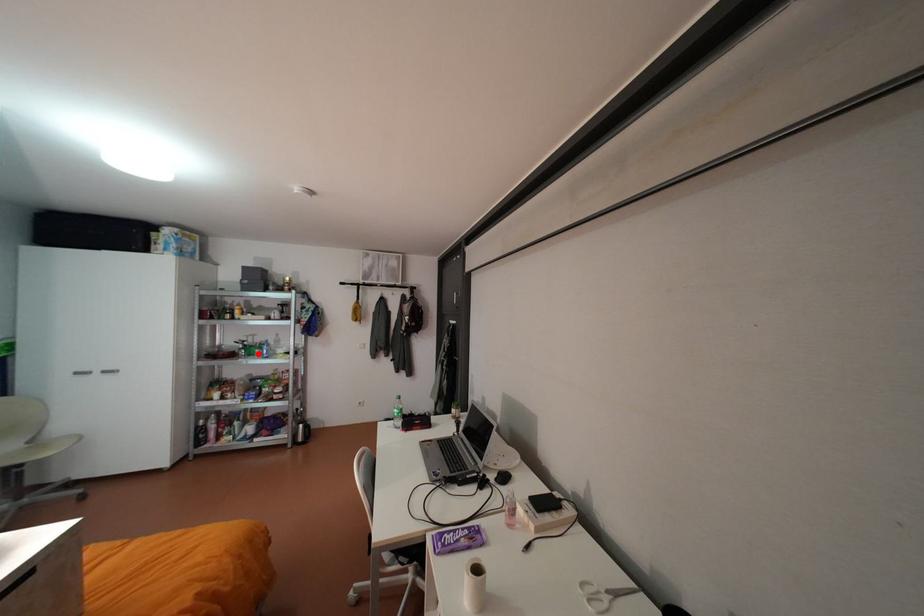
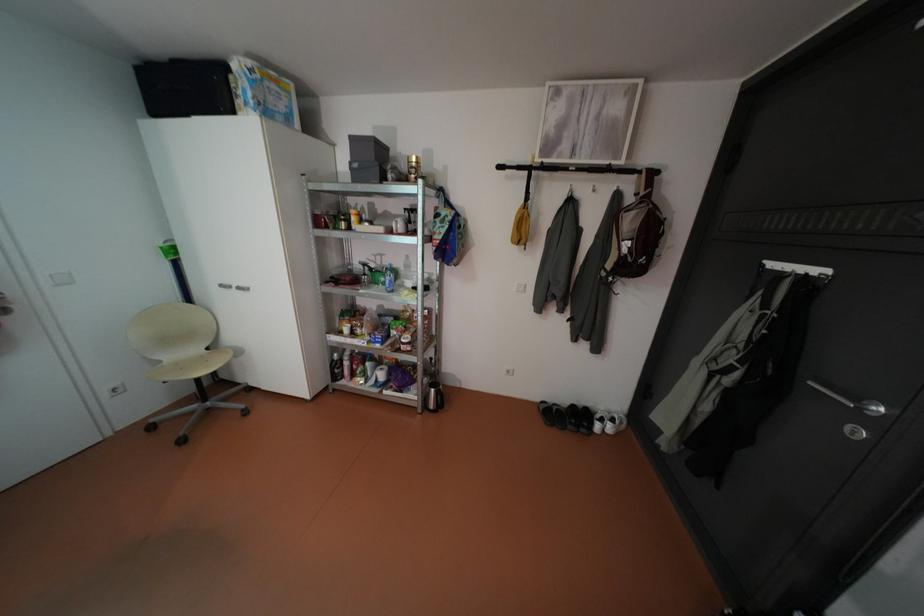
Find the pixel in the second image that matches the highlighted location in the first image.

(383, 282)